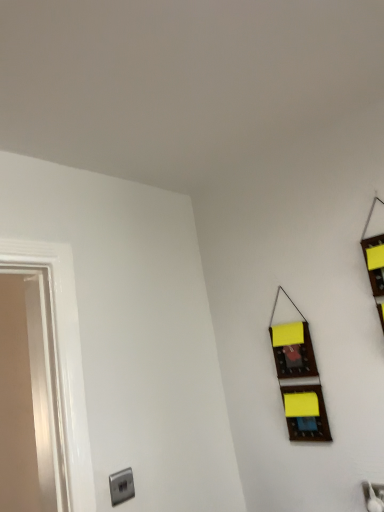
Question: Is satin silver outlet at lower left aimed at wooden organizer at right?

Choices:
 (A) no
 (B) yes

Answer: (A)

Question: From the image's perspective, is satin silver outlet at lower left below wooden organizer at right?

Choices:
 (A) no
 (B) yes

Answer: (B)

Question: Does satin silver outlet at lower left appear on the right side of wooden organizer at right?

Choices:
 (A) no
 (B) yes

Answer: (A)

Question: Is satin silver outlet at lower left closer to the viewer compared to wooden organizer at right?

Choices:
 (A) yes
 (B) no

Answer: (A)

Question: Is satin silver outlet at lower left at the left side of wooden organizer at right?

Choices:
 (A) yes
 (B) no

Answer: (A)

Question: Does satin silver outlet at lower left have a greater height compared to wooden organizer at right?

Choices:
 (A) no
 (B) yes

Answer: (A)

Question: Is wooden organizer at right turned away from satin silver outlet at lower left?

Choices:
 (A) no
 (B) yes

Answer: (A)

Question: Is wooden organizer at right wider than satin silver outlet at lower left?

Choices:
 (A) yes
 (B) no

Answer: (A)

Question: Can you confirm if wooden organizer at right is positioned to the right of satin silver outlet at lower left?

Choices:
 (A) no
 (B) yes

Answer: (B)

Question: Is wooden organizer at right further to the viewer compared to satin silver outlet at lower left?

Choices:
 (A) yes
 (B) no

Answer: (A)

Question: Considering the relative sizes of wooden organizer at right and satin silver outlet at lower left in the image provided, is wooden organizer at right shorter than satin silver outlet at lower left?

Choices:
 (A) yes
 (B) no

Answer: (B)

Question: Does wooden organizer at right turn towards satin silver outlet at lower left?

Choices:
 (A) yes
 (B) no

Answer: (B)

Question: Is wooden organizer at right to the left or to the right of satin silver outlet at lower left in the image?

Choices:
 (A) right
 (B) left

Answer: (A)